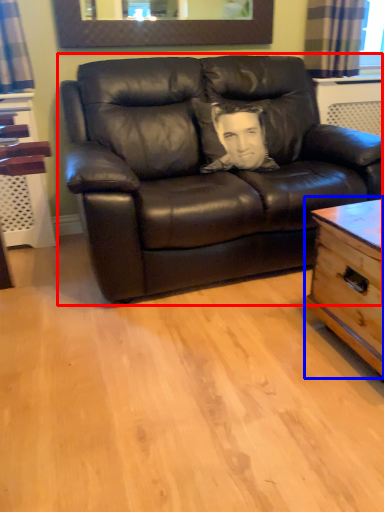
Question: Which object appears farthest to the camera in this image, studio couch (highlighted by a red box) or table (highlighted by a blue box)?

Choices:
 (A) studio couch
 (B) table

Answer: (A)